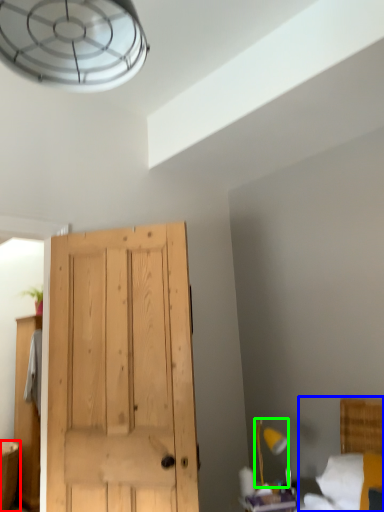
Question: Which object is the closest to the vanity (highlighted by a red box)? Choose among these: bed (highlighted by a blue box) or light fixture (highlighted by a green box).

Choices:
 (A) bed
 (B) light fixture

Answer: (B)